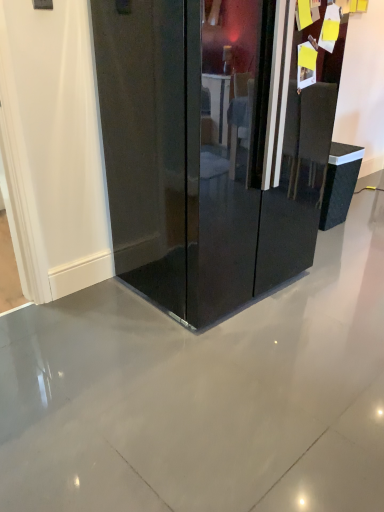
Question: From a real-world perspective, is glossy black refrigerator at center positioned above or below black glossy trash can at right?

Choices:
 (A) below
 (B) above

Answer: (B)

Question: Is point [x=187, y=118] positioned closer to the camera than point [x=332, y=185]?

Choices:
 (A) closer
 (B) farther

Answer: (A)

Question: In terms of height, does glossy black refrigerator at center look taller or shorter compared to black glossy trash can at right?

Choices:
 (A) short
 (B) tall

Answer: (B)

Question: Looking at their shapes, would you say black glossy trash can at right is wider or thinner than glossy black refrigerator at center?

Choices:
 (A) wide
 (B) thin

Answer: (B)

Question: Is point (347, 155) closer or farther from the camera than point (117, 14)?

Choices:
 (A) closer
 (B) farther

Answer: (B)

Question: Is black glossy trash can at right bigger or smaller than glossy black refrigerator at center?

Choices:
 (A) small
 (B) big

Answer: (A)

Question: Would you say black glossy trash can at right is inside or outside glossy black refrigerator at center?

Choices:
 (A) inside
 (B) outside

Answer: (B)